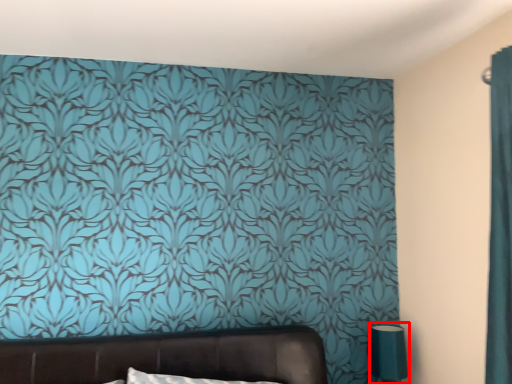
Question: Where is table lamp (annotated by the red box) located in relation to furniture in the image?

Choices:
 (A) left
 (B) right

Answer: (B)